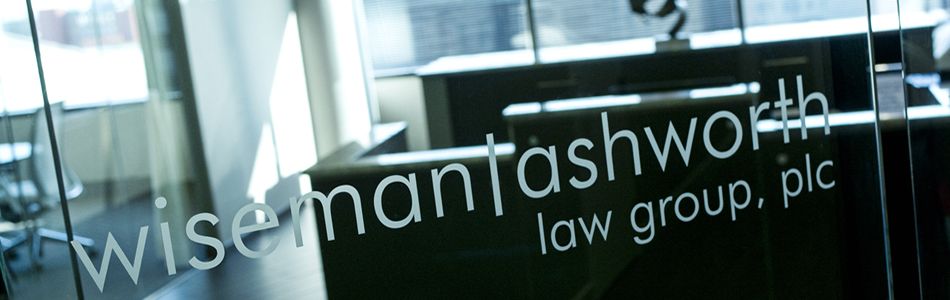
This screenshot has height=300, width=950. I want to click on chair legs, so pyautogui.click(x=61, y=237), pyautogui.click(x=32, y=237), pyautogui.click(x=11, y=242).